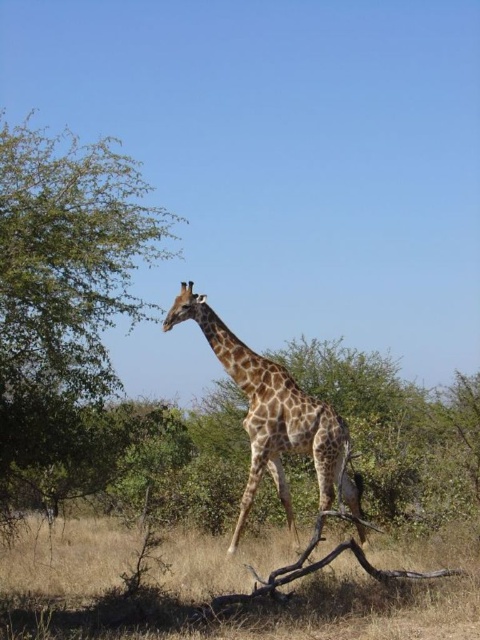
Which is behind, point (451, 580) or point (338, 461)?

Positioned behind is point (338, 461).

Can you confirm if dry grass at lower center is smaller than golden-brown spotted giraffe at center?

Actually, dry grass at lower center might be larger than golden-brown spotted giraffe at center.

The image size is (480, 640). What do you see at coordinates (228, 588) in the screenshot?
I see `dry grass at lower center` at bounding box center [228, 588].

Where is `dry grass at lower center`? The width and height of the screenshot is (480, 640). dry grass at lower center is located at coordinates (228, 588).

Can you confirm if green leafy tree at upper left is positioned to the right of dry grass at lower center?

No, green leafy tree at upper left is not to the right of dry grass at lower center.

Which is in front, point (45, 168) or point (51, 588)?

Positioned in front is point (45, 168).

Does point (3, 396) lie behind point (54, 582)?

No, it is in front of (54, 582).

At what (x,y) coordinates should I click in order to perform the action: click on green leafy tree at upper left. Please return your answer as a coordinate pair (x, y). The height and width of the screenshot is (640, 480). Looking at the image, I should click on (64, 307).

Does green leafy tree at upper left have a greater width compared to golden-brown spotted giraffe at center?

Yes.

Does green leafy tree at upper left have a smaller size compared to golden-brown spotted giraffe at center?

Actually, green leafy tree at upper left might be larger than golden-brown spotted giraffe at center.

Where is `green leafy tree at upper left`? The width and height of the screenshot is (480, 640). green leafy tree at upper left is located at coordinates (64, 307).